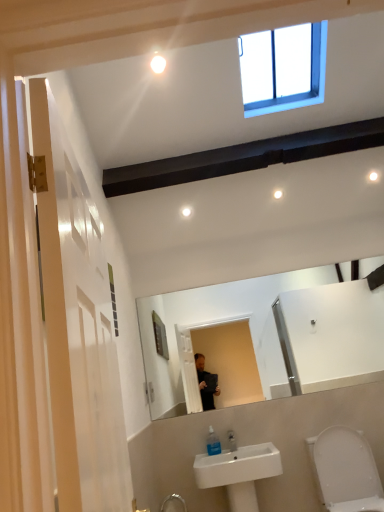
Question: Is white glossy light bulb at upper center taller or shorter than white glossy toilet at lower right?

Choices:
 (A) short
 (B) tall

Answer: (A)

Question: Is white glossy light bulb at upper center to the left or to the right of white glossy toilet at lower right in the image?

Choices:
 (A) right
 (B) left

Answer: (B)

Question: Which object is the farthest from the white ceramic sink at lower center?

Choices:
 (A) white glossy toilet at lower right
 (B) white glossy light bulb at upper center
 (C) clear plastic soap dispenser at lower center

Answer: (B)

Question: Estimate the real-world distances between objects in this image. Which object is farther from the clear plastic soap dispenser at lower center?

Choices:
 (A) white glossy light bulb at upper center
 (B) white ceramic sink at lower center
 (C) white glossy toilet at lower right

Answer: (A)